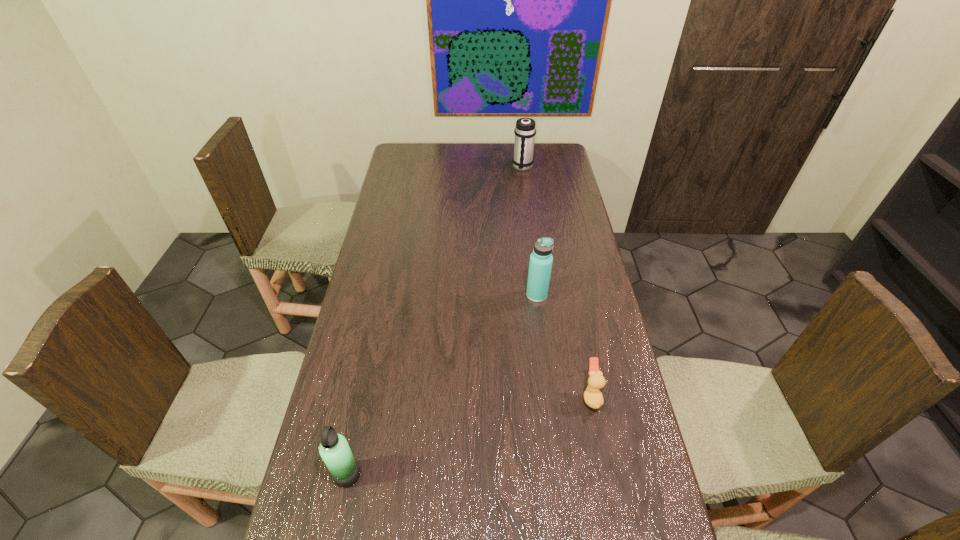
I want to click on the second farthest object, so click(540, 265).

Identify the location of the farthest thermos bottle. The height and width of the screenshot is (540, 960). (525, 130).

Identify the location of the nearest object. This screenshot has width=960, height=540. (334, 449).

Image resolution: width=960 pixels, height=540 pixels. Find the location of `the leftmost object`. the leftmost object is located at coordinates (334, 449).

Image resolution: width=960 pixels, height=540 pixels. Identify the location of the shortest object. tap(593, 397).

The width and height of the screenshot is (960, 540). I want to click on duck, so click(593, 397).

The width and height of the screenshot is (960, 540). I want to click on vacant region located on the left of the third nearest object, so click(x=481, y=295).

At what (x,y) coordinates should I click in order to perform the action: click on free point located 0.380m on the side with the handle of the farthest thermos bottle. Please return your answer as a coordinate pair (x, y). Looking at the image, I should click on (530, 226).

The height and width of the screenshot is (540, 960). What are the coordinates of `vacant space located on the right of the nearest object` in the screenshot? It's located at (526, 475).

Find the location of a particular element. vacant position located on the beak of the third farthest object is located at coordinates (549, 396).